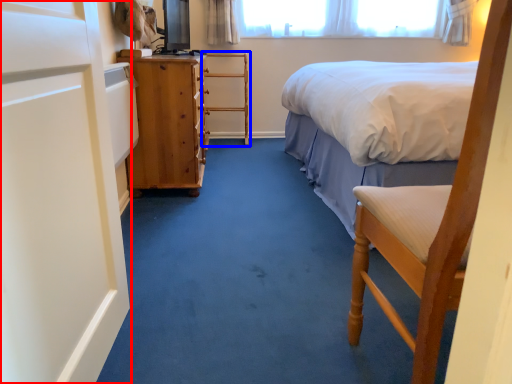
Question: Which point is further to the camera, screen door (highlighted by a red box) or armchair (highlighted by a blue box)?

Choices:
 (A) screen door
 (B) armchair

Answer: (B)